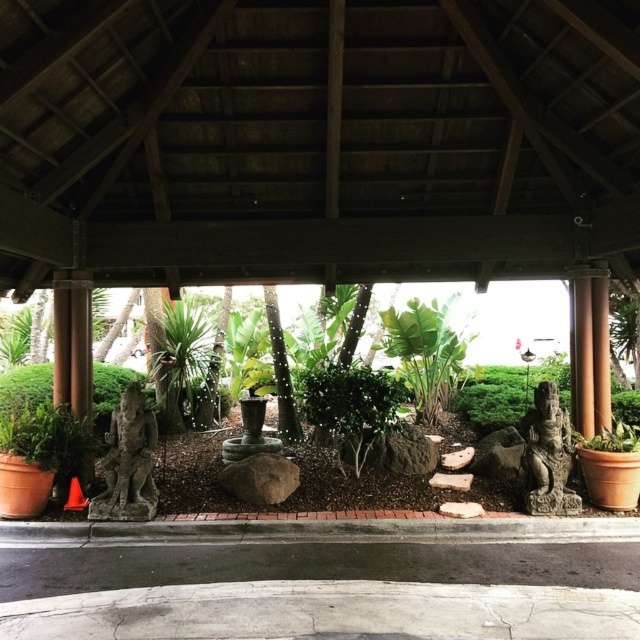
You are standing under the wooden pavilion and want to take a photo of both the gray stone statue at lower left and the stone statue at center. Which statue should you position closer to the camera to include both in the frame?

You should position the gray stone statue at lower left closer to the camera because it is in front of the stone statue at center, so placing it nearer will ensure both are visible in the photo.

You are planning to place a 1.5 meter wide bench between the gray stone statue at lower left and the stone statue at center. Will there be enough space for the bench to fit between them?

The gray stone statue at lower left and the stone statue at center are 4.39 meters apart. Since the bench is 1.5 meters wide, there is sufficient space between them to place the bench.